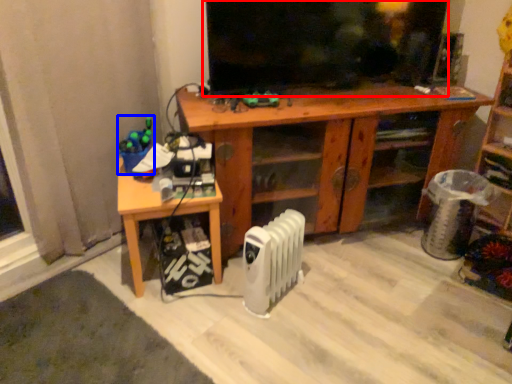
Question: Which object appears closest to the camera in this image, tv show (highlighted by a red box) or toy (highlighted by a blue box)?

Choices:
 (A) tv show
 (B) toy

Answer: (A)